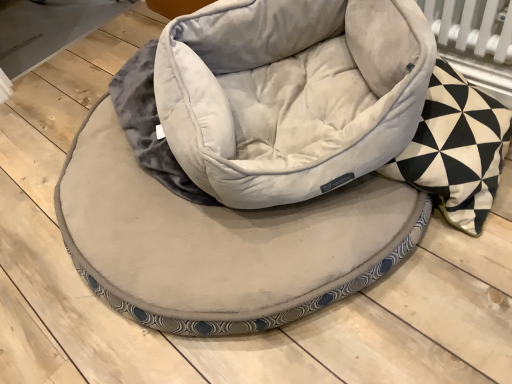
Question: Is suede-like beige bean bag chair at center positioned before black and white geometric patterned pillow at right?

Choices:
 (A) no
 (B) yes

Answer: (A)

Question: Can you confirm if suede-like beige bean bag chair at center is taller than black and white geometric patterned pillow at right?

Choices:
 (A) yes
 (B) no

Answer: (B)

Question: Is suede-like beige bean bag chair at center at the left side of black and white geometric patterned pillow at right?

Choices:
 (A) yes
 (B) no

Answer: (A)

Question: Considering the relative sizes of suede-like beige bean bag chair at center and black and white geometric patterned pillow at right in the image provided, is suede-like beige bean bag chair at center wider than black and white geometric patterned pillow at right?

Choices:
 (A) yes
 (B) no

Answer: (A)

Question: Could black and white geometric patterned pillow at right be considered to be inside suede-like beige bean bag chair at center?

Choices:
 (A) no
 (B) yes

Answer: (A)

Question: From the image's perspective, is black and white geometric patterned pillow at right above or below velvet-like beige dog bed at center?

Choices:
 (A) below
 (B) above

Answer: (B)

Question: In the image, is black and white geometric patterned pillow at right positioned in front of or behind velvet-like beige dog bed at center?

Choices:
 (A) front
 (B) behind

Answer: (A)

Question: From a real-world perspective, is black and white geometric patterned pillow at right positioned above or below velvet-like beige dog bed at center?

Choices:
 (A) below
 (B) above

Answer: (B)

Question: Looking at the image, does black and white geometric patterned pillow at right seem bigger or smaller compared to velvet-like beige dog bed at center?

Choices:
 (A) big
 (B) small

Answer: (B)

Question: Is black and white geometric patterned pillow at right spatially inside suede-like beige bean bag chair at center, or outside of it?

Choices:
 (A) inside
 (B) outside

Answer: (B)

Question: Relative to suede-like beige bean bag chair at center, is black and white geometric patterned pillow at right in front or behind?

Choices:
 (A) behind
 (B) front

Answer: (B)

Question: From the image's perspective, is black and white geometric patterned pillow at right above or below suede-like beige bean bag chair at center?

Choices:
 (A) below
 (B) above

Answer: (A)

Question: From a real-world perspective, is black and white geometric patterned pillow at right above or below suede-like beige bean bag chair at center?

Choices:
 (A) below
 (B) above

Answer: (A)

Question: From a real-world perspective, is suede-like beige bean bag chair at center physically located above or below velvet-like beige dog bed at center?

Choices:
 (A) below
 (B) above

Answer: (B)

Question: Choose the correct answer: Is suede-like beige bean bag chair at center inside velvet-like beige dog bed at center or outside it?

Choices:
 (A) inside
 (B) outside

Answer: (B)